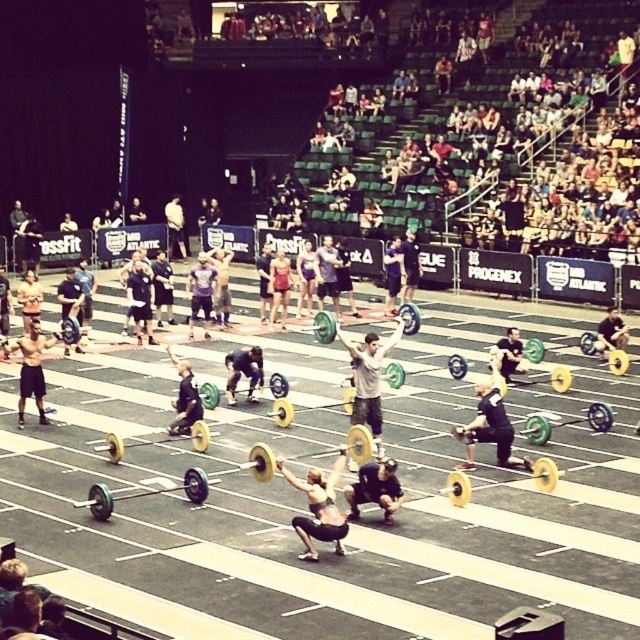
From the picture: Is matte black tank top at center bigger than shiny black barbell at center?

Yes, matte black tank top at center is bigger than shiny black barbell at center.

What do you see at coordinates (317, 508) in the screenshot? The height and width of the screenshot is (640, 640). I see `matte black tank top at center` at bounding box center [317, 508].

Which is in front, point (337, 461) or point (228, 388)?

Point (337, 461) is in front.

At what (x,y) coordinates should I click in order to perform the action: click on matte black tank top at center. Please return your answer as a coordinate pair (x, y). The height and width of the screenshot is (640, 640). Looking at the image, I should click on (317, 508).

Does matte black tank top at center have a lesser width compared to yellow rubber barbell at center?

In fact, matte black tank top at center might be wider than yellow rubber barbell at center.

Which is in front, point (339, 460) or point (452, 476)?

Point (339, 460) is more forward.

This screenshot has height=640, width=640. Identify the location of matte black tank top at center. (317, 508).

Is gold/yellow weight at center bigger than matte pink shorts at center?

Incorrect, gold/yellow weight at center is not larger than matte pink shorts at center.

Is point (200, 440) less distant than point (288, 268)?

Yes, point (200, 440) is closer to viewer.

You are a GUI agent. You are given a task and a screenshot of the screen. Output one action in this format:
    pyautogui.click(x=<x>, y=<y>)
    Task: Click on the gold/yellow weight at center
    
    Given the screenshot: What is the action you would take?
    pyautogui.click(x=157, y=440)